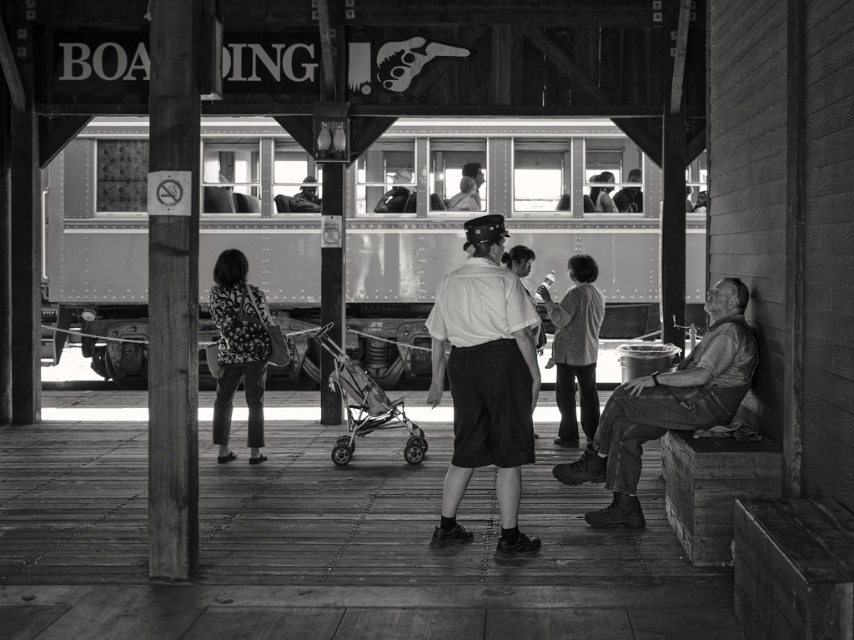
Question: Is smooth metal train at center bigger than floral-patterned fabric at center?

Choices:
 (A) yes
 (B) no

Answer: (A)

Question: Is light gray sweater at center thinner than metallic silver stroller at center?

Choices:
 (A) no
 (B) yes

Answer: (B)

Question: Does white shirt at center have a smaller size compared to light gray sweater at center?

Choices:
 (A) no
 (B) yes

Answer: (A)

Question: Considering the real-world distances, which object is closest to the white shirt at center?

Choices:
 (A) smooth metal train at center
 (B) light gray sweater at center
 (C) denim overalls at right

Answer: (C)

Question: Which point is closer to the camera?

Choices:
 (A) (139, 177)
 (B) (585, 324)
 (C) (496, 321)
 (D) (348, 436)

Answer: (C)

Question: Among these objects, which one is nearest to the camera?

Choices:
 (A) denim overalls at right
 (B) floral-patterned fabric at center

Answer: (A)